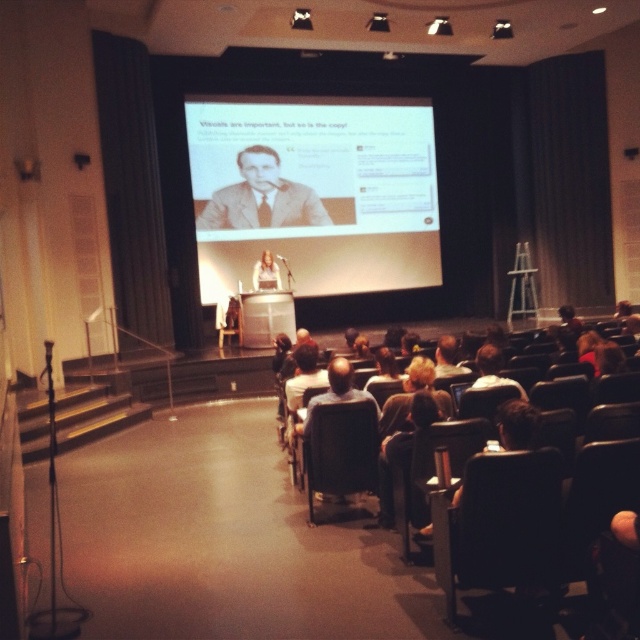
Between point (205, 145) and point (234, 202), which one is positioned behind?

The point (234, 202) is behind.

Is matte projector screen at center to the left of matte beige suit at center from the viewer's perspective?

Correct, you'll find matte projector screen at center to the left of matte beige suit at center.

Is point (250, 196) more distant than point (314, 220)?

No, it is not.

I want to click on matte projector screen at center, so click(314, 193).

Can you confirm if black leather chair at lower right is positioned to the right of matte beige suit at center?

Correct, you'll find black leather chair at lower right to the right of matte beige suit at center.

From the picture: Does black leather chair at lower right have a smaller size compared to matte beige suit at center?

Indeed, black leather chair at lower right has a smaller size compared to matte beige suit at center.

The image size is (640, 640). Identify the location of black leather chair at lower right. (499, 524).

Where is `black leather chair at lower right`? black leather chair at lower right is located at coordinates (499, 524).

Which of these two, black leather chair at center or matte plastic woman at center, stands taller?

black leather chair at center

Image resolution: width=640 pixels, height=640 pixels. What are the coordinates of `black leather chair at center` in the screenshot? It's located at (340, 449).

The height and width of the screenshot is (640, 640). What do you see at coordinates (340, 449) in the screenshot?
I see `black leather chair at center` at bounding box center [340, 449].

The height and width of the screenshot is (640, 640). What are the coordinates of `black leather chair at center` in the screenshot? It's located at (340, 449).